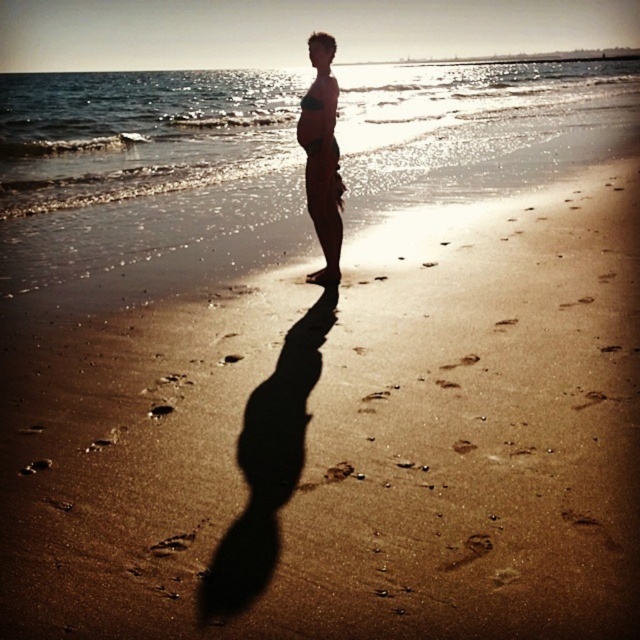
Question: Among these objects, which one is farthest from the camera?

Choices:
 (A) translucent water at upper center
 (B) matte skin at center

Answer: (A)

Question: Which of the following is the closest to the observer?

Choices:
 (A) (324, 166)
 (B) (243, 141)

Answer: (A)

Question: From the image, what is the correct spatial relationship of translucent water at upper center in relation to matte skin at center?

Choices:
 (A) left
 (B) right

Answer: (A)

Question: Does translucent water at upper center have a lesser width compared to matte skin at center?

Choices:
 (A) yes
 (B) no

Answer: (B)

Question: Is translucent water at upper center above matte skin at center?

Choices:
 (A) yes
 (B) no

Answer: (A)